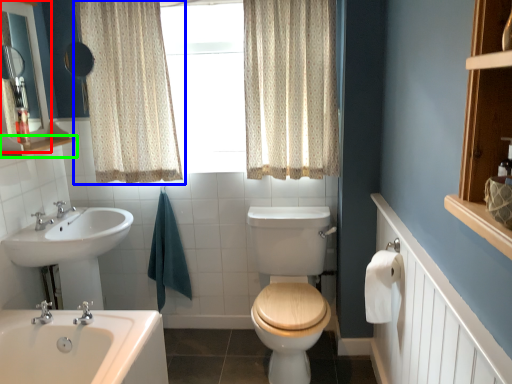
Question: Which is nearer to the medicine cabinet (highlighted by a red box)? curtain (highlighted by a blue box) or balustrade (highlighted by a green box).

Choices:
 (A) curtain
 (B) balustrade

Answer: (B)